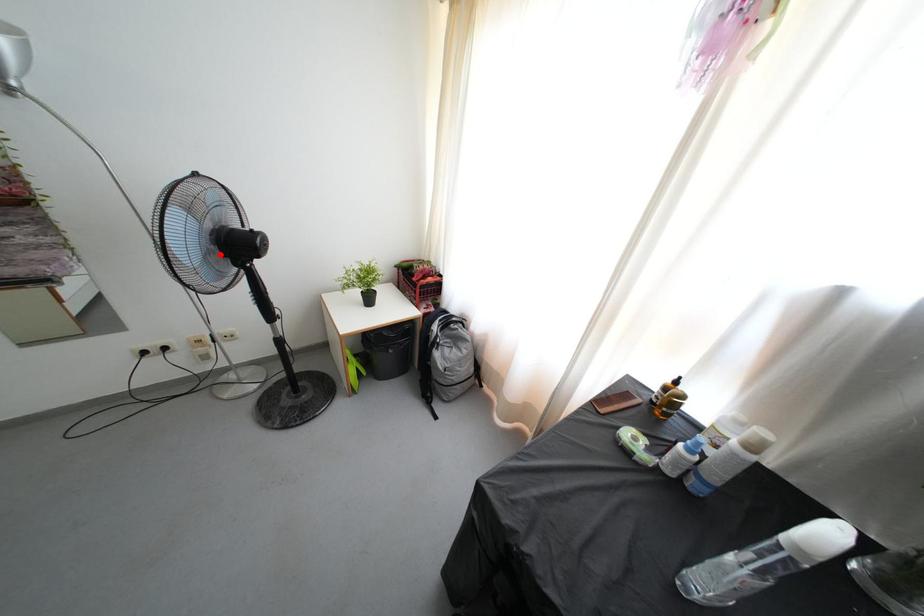
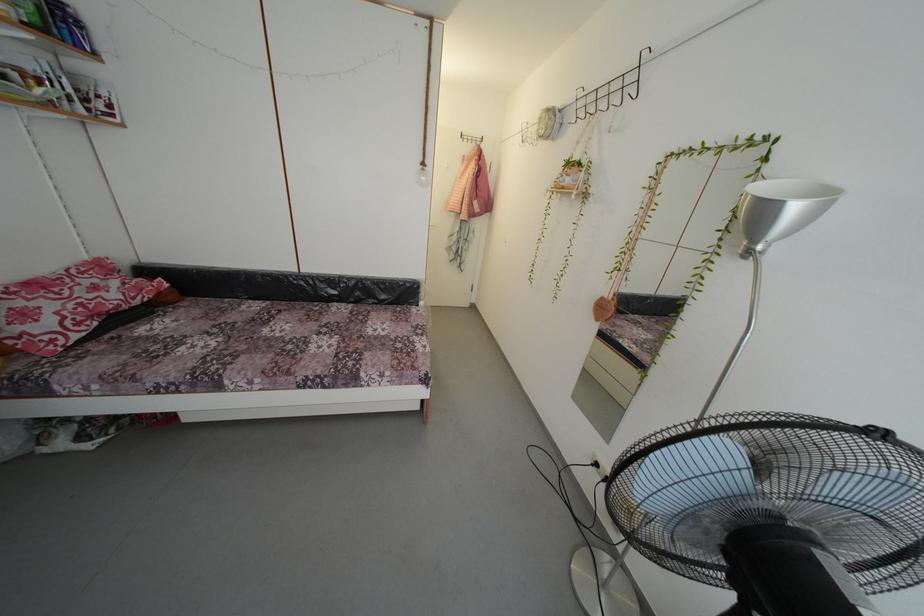
Question: I am providing you with two images of the same scene from different viewpoints. A red point is marked on the first image. At the location where the point appears in image 1, is it still visible in image 2?

Choices:
 (A) Yes
 (B) No

Answer: (A)